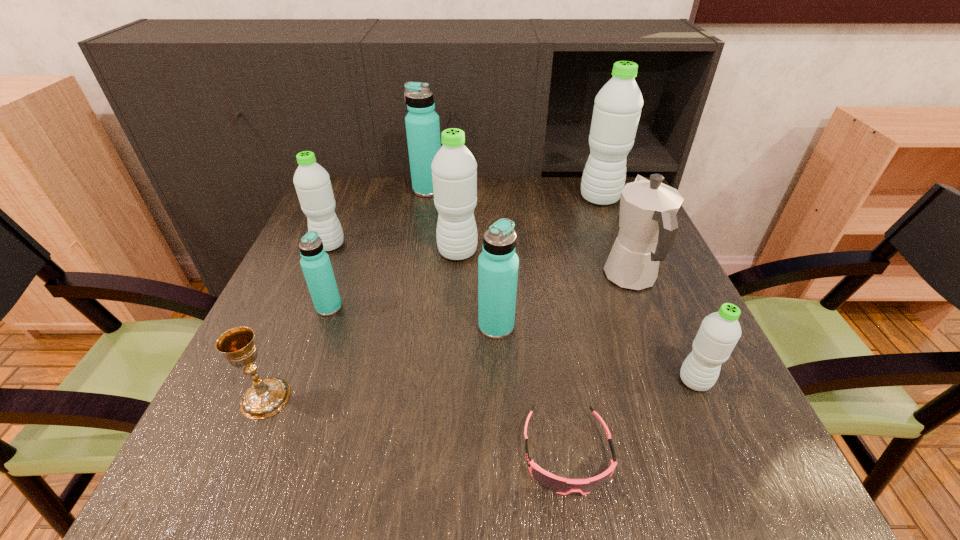
This screenshot has width=960, height=540. I want to click on the smallest blue water bottle, so click(x=315, y=263).

This screenshot has height=540, width=960. Find the location of `the nearest green water bottle`. the nearest green water bottle is located at coordinates 719,332.

You are a GUI agent. You are given a task and a screenshot of the screen. Output one action in this format:
    pyautogui.click(x=<x>, y=<y>)
    Task: Click on the smallest green water bottle
    The width and height of the screenshot is (960, 540).
    Given the screenshot: What is the action you would take?
    pyautogui.click(x=719, y=332)

This screenshot has width=960, height=540. In order to click on chalice in this screenshot , I will do `click(265, 397)`.

Find the location of a particular element. This screenshot has width=960, height=540. goggles is located at coordinates (560, 485).

The height and width of the screenshot is (540, 960). I want to click on pink goggles, so pos(560,485).

Find the location of a particular element. Image resolution: width=960 pixels, height=540 pixels. free point located on the front of the farthest green water bottle is located at coordinates (615, 238).

The height and width of the screenshot is (540, 960). I want to click on free spot located on the front of the farthest blue water bottle, so click(x=423, y=215).

Locate an element on the screen. vacant region located 0.330m on the front of the third green water bottle from right to left is located at coordinates (449, 384).

You are a GUI agent. You are given a task and a screenshot of the screen. Output one action in this format:
    pyautogui.click(x=<x>, y=<y>)
    Task: Click on the free space located on the front of the gray coffeepot
    Image resolution: width=960 pixels, height=540 pixels.
    Given the screenshot: What is the action you would take?
    pyautogui.click(x=664, y=362)